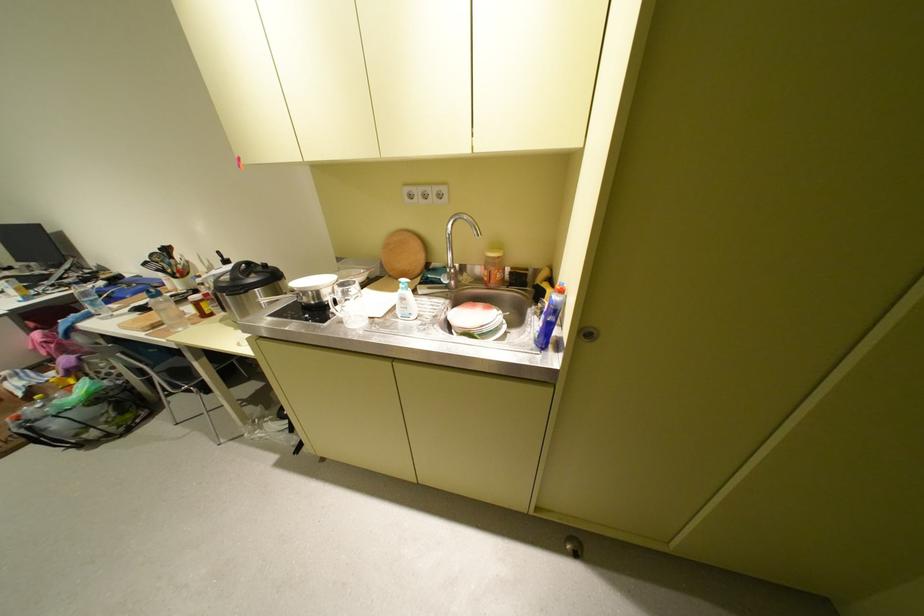
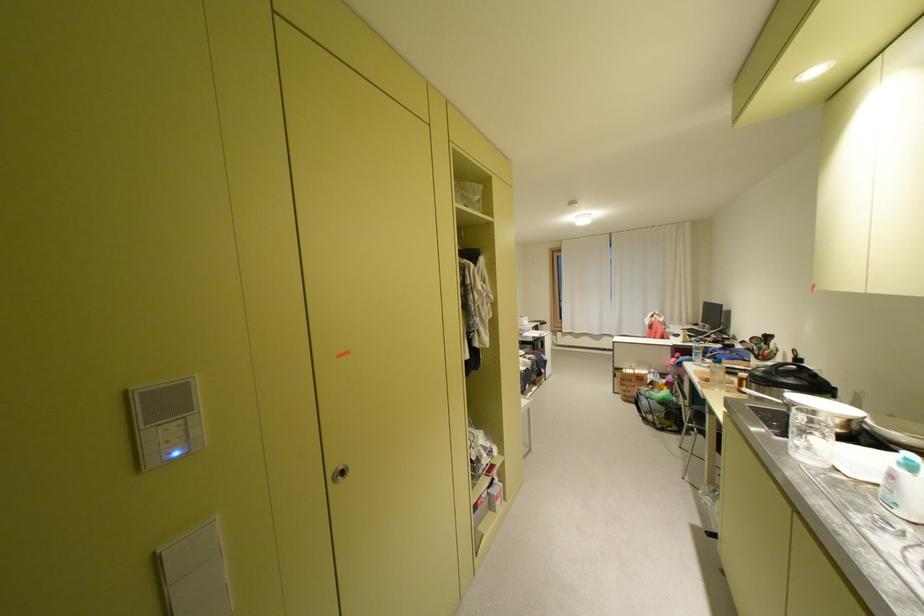
Find the pixel in the second image that matches [266,274] in the first image.

(808, 378)